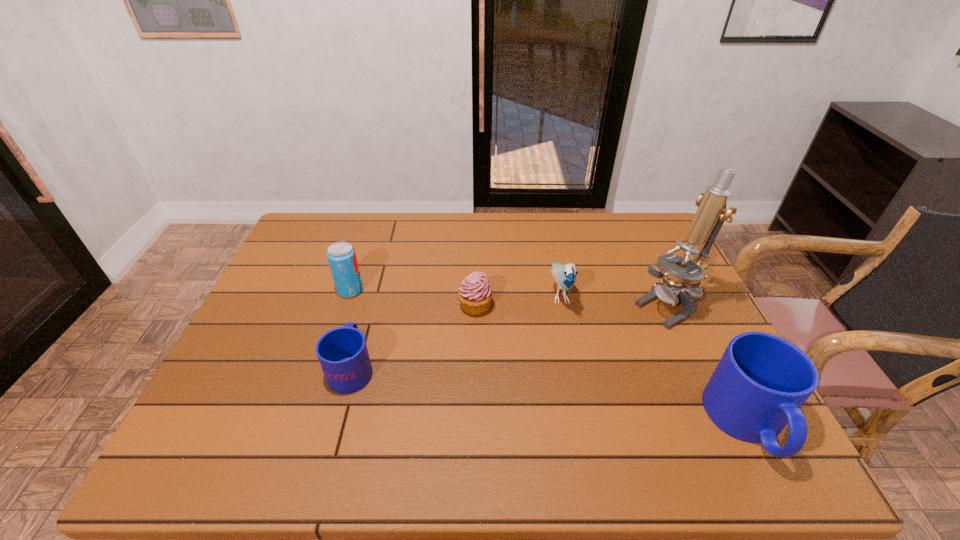
This screenshot has height=540, width=960. What are the coordinates of `free region located on the back of the soda can` in the screenshot? It's located at (372, 226).

This screenshot has height=540, width=960. In order to click on free space located at the face of the bird in this screenshot , I will do `click(571, 351)`.

The width and height of the screenshot is (960, 540). I want to click on free region located 0.290m on the back of the tallest object, so click(634, 230).

The height and width of the screenshot is (540, 960). What are the coordinates of `mug present at the right edge` in the screenshot? It's located at (761, 381).

This screenshot has width=960, height=540. In order to click on microscope that is at the right edge in this screenshot , I will do `click(711, 213)`.

At what (x,y) coordinates should I click in order to perform the action: click on object located in the near right corner section of the desktop. Please return your answer as a coordinate pair (x, y). Looking at the image, I should click on (761, 381).

The width and height of the screenshot is (960, 540). Find the location of `vacant space at the far edge`. vacant space at the far edge is located at coordinates (371, 235).

The width and height of the screenshot is (960, 540). Find the location of `free region at the near edge of the desktop`. free region at the near edge of the desktop is located at coordinates (356, 403).

Locate an element on the screen. free space at the left edge is located at coordinates (299, 302).

This screenshot has width=960, height=540. In the image, there is a desktop. What are the coordinates of `blank space at the right edge` in the screenshot? It's located at (640, 286).